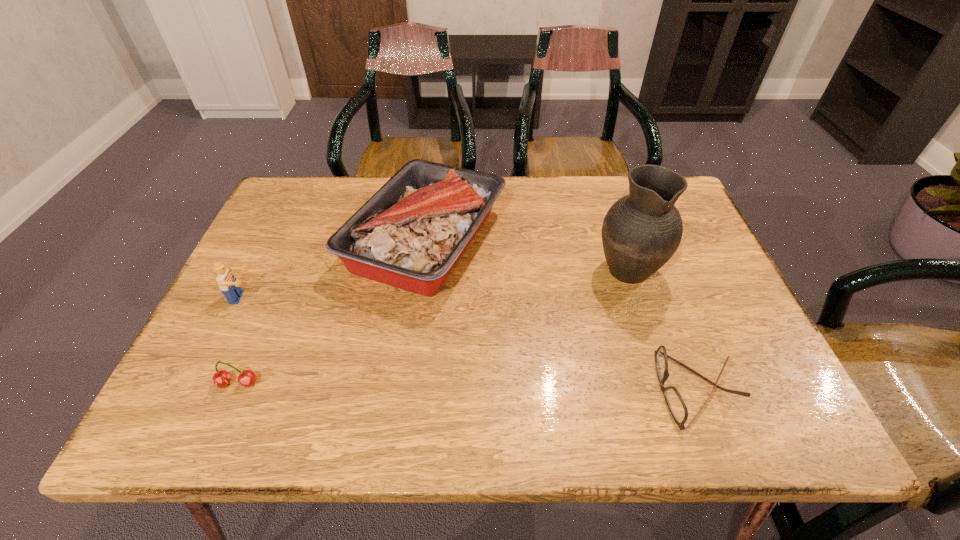
Where is `object located in the near right corner section of the desktop`? The image size is (960, 540). object located in the near right corner section of the desktop is located at coordinates (677, 407).

Identify the location of vacant space at the far edge of the desktop. Image resolution: width=960 pixels, height=540 pixels. (556, 177).

This screenshot has width=960, height=540. Find the location of `free space at the near edge of the desktop`. free space at the near edge of the desktop is located at coordinates (522, 403).

This screenshot has height=540, width=960. Find the location of `vacant space at the left edge of the desktop`. vacant space at the left edge of the desktop is located at coordinates (254, 355).

The height and width of the screenshot is (540, 960). In the image, there is a desktop. Find the location of `free space at the right edge`. free space at the right edge is located at coordinates 681,267.

You are a GUI agent. You are given a task and a screenshot of the screen. Output one action in this format:
    pyautogui.click(x=<x>, y=<y>)
    Task: Click on the free point at the near right corner
    This screenshot has height=540, width=960.
    Given the screenshot: What is the action you would take?
    pyautogui.click(x=790, y=411)

Locate an element on the screen. vacant area between the tallest object and the shortest object is located at coordinates [x=662, y=329].

Locate an element on the screen. The width and height of the screenshot is (960, 540). free space between the shortest object and the cherry is located at coordinates (468, 387).

This screenshot has width=960, height=540. Find the location of `free space between the Lego and the spectacles`. free space between the Lego and the spectacles is located at coordinates (470, 343).

Where is `free area in between the tray and the pitcher`? The width and height of the screenshot is (960, 540). free area in between the tray and the pitcher is located at coordinates (527, 254).